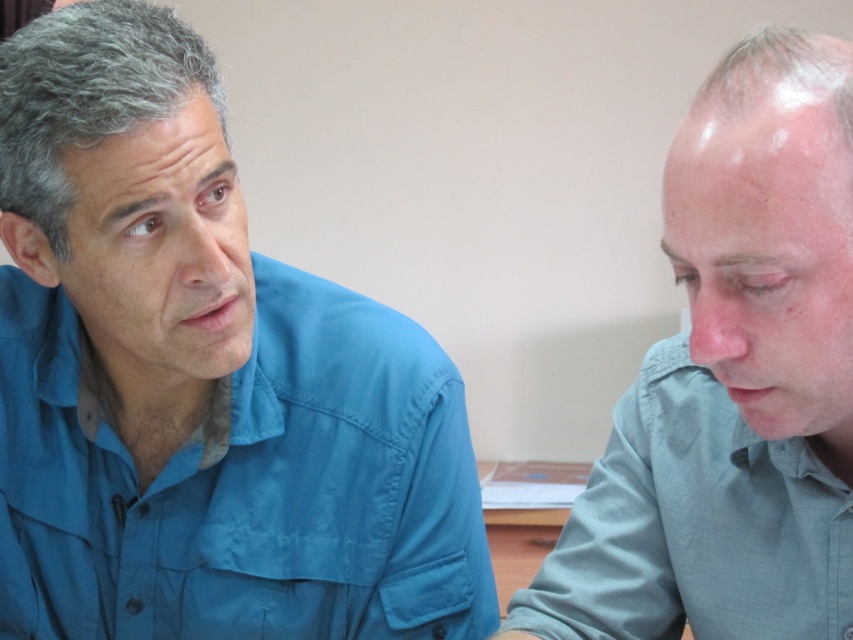
Does point (234, 534) lie behind point (581, 552)?

Yes, it is behind point (581, 552).

Image resolution: width=853 pixels, height=640 pixels. In order to click on blue fabric shirt at left in this screenshot , I will do pos(200,380).

This screenshot has height=640, width=853. What do you see at coordinates (200, 380) in the screenshot?
I see `blue fabric shirt at left` at bounding box center [200, 380].

This screenshot has width=853, height=640. In order to click on blue fabric shirt at left in this screenshot , I will do (x=200, y=380).

Can you confirm if gray matte shirt at right is positioned above light blue cotton shirt at right?

Indeed, gray matte shirt at right is positioned over light blue cotton shirt at right.

Is gray matte shirt at right positioned in front of light blue cotton shirt at right?

Yes, gray matte shirt at right is in front of light blue cotton shirt at right.

Is point (579, 608) in front of point (685, 515)?

No, (579, 608) is further to viewer.

The width and height of the screenshot is (853, 640). I want to click on gray matte shirt at right, so click(732, 381).

Between blue fabric shirt at left and light blue cotton shirt at right, which one appears on the left side from the viewer's perspective?

blue fabric shirt at left is more to the left.

Can you confirm if blue fabric shirt at left is smaller than light blue cotton shirt at right?

Actually, blue fabric shirt at left might be larger than light blue cotton shirt at right.

Locate an element on the screen. The height and width of the screenshot is (640, 853). blue fabric shirt at left is located at coordinates (200, 380).

Identify the location of blue fabric shirt at left. The height and width of the screenshot is (640, 853). (200, 380).